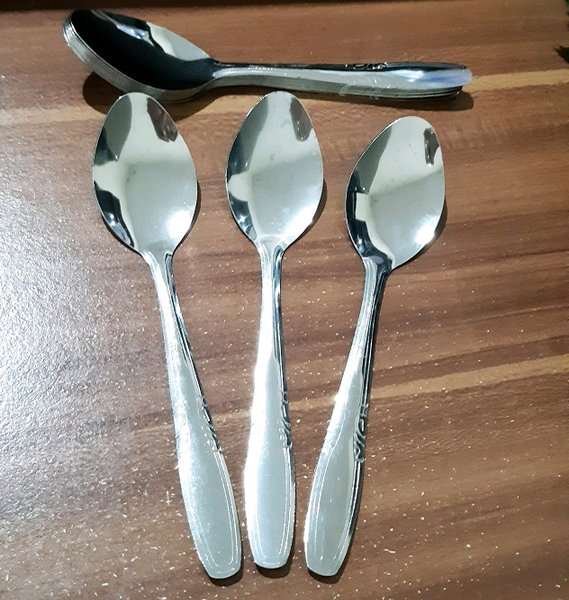
Locate an element on the screen. This screenshot has width=569, height=600. handle is located at coordinates (183, 370), (270, 368), (352, 385), (352, 77), (352, 91).